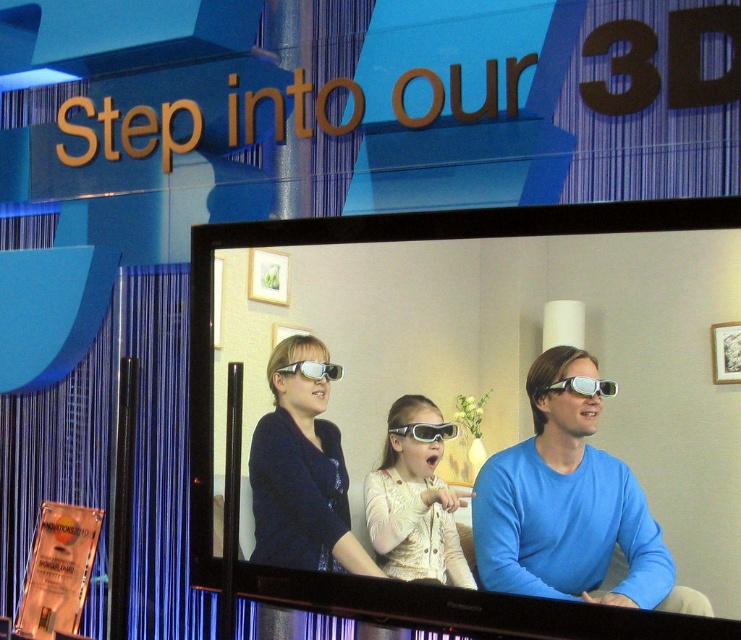
You are a photographer positioned at the camera. You want to capture a closeup of the blue matte shirt at center. Can you do it without moving the camera?

The blue matte shirt at center is 2.45 meters from the camera, so you can capture a closeup without moving the camera by adjusting the zoom lens to magnify the subject from that distance.